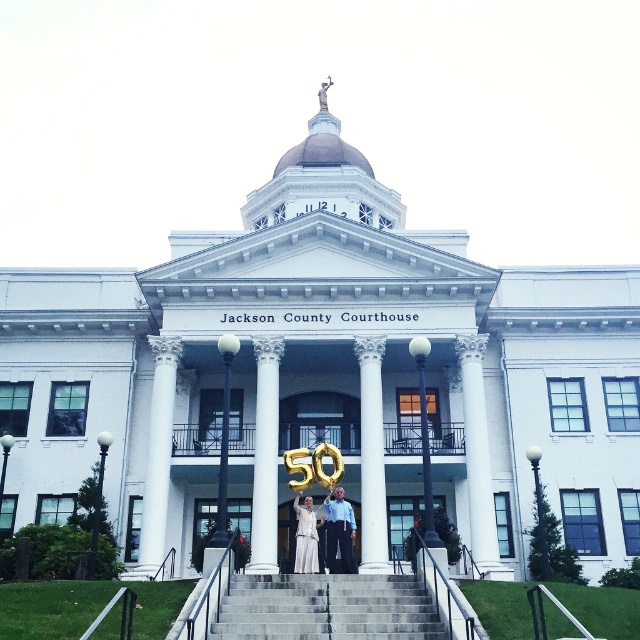
Question: Among these points, which one is nearest to the camera?

Choices:
 (A) (273, 420)
 (B) (364, 420)
 (C) (305, 538)

Answer: (C)

Question: Based on their relative distances, which object is nearer to the matte gold balloons at center?

Choices:
 (A) white smooth column at center
 (B) white satin dress at center

Answer: (B)

Question: Is white smooth column at center bigger than white satin dress at center?

Choices:
 (A) yes
 (B) no

Answer: (A)

Question: Which point is closer to the camera?

Choices:
 (A) white satin dress at center
 (B) matte gold balloons at center
 (C) white smooth column at center
 (D) white marble column at center

Answer: (A)

Question: Does white smooth column at center have a greater width compared to white satin dress at center?

Choices:
 (A) yes
 (B) no

Answer: (A)

Question: From the image, what is the correct spatial relationship of gray concrete stairs at center in relation to white marble column at center?

Choices:
 (A) left
 (B) right

Answer: (A)